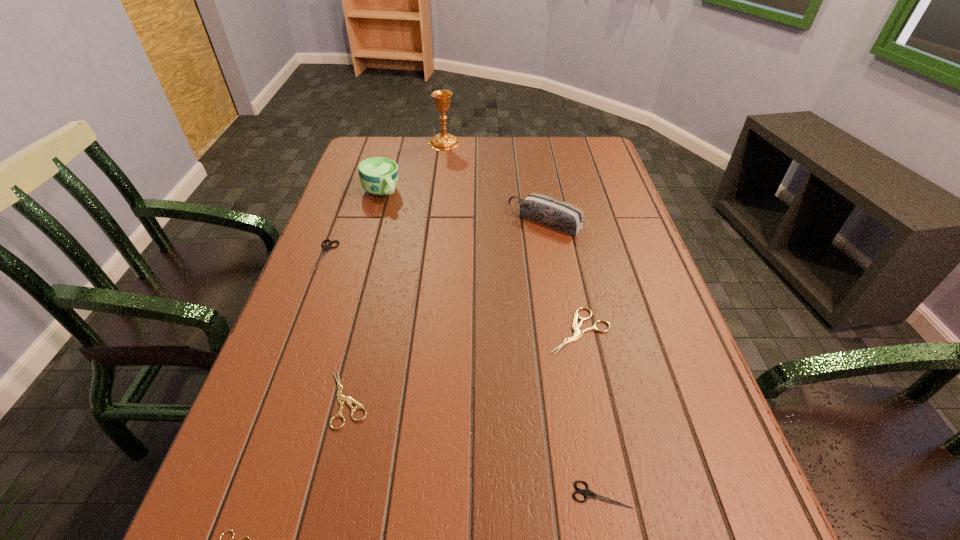
Where is `the second beige shears from right to left`? the second beige shears from right to left is located at coordinates (342, 399).

Where is `the third shears from left to right`? Image resolution: width=960 pixels, height=540 pixels. the third shears from left to right is located at coordinates (342, 399).

Find the location of a particular element. the smaller black shears is located at coordinates (587, 493).

Locate an element on the screen. Image resolution: width=960 pixels, height=540 pixels. the second nearest shears is located at coordinates (587, 493).

Locate an element on the screen. The width and height of the screenshot is (960, 540). blank area located on the right of the chalice is located at coordinates (510, 143).

You are a GUI agent. You are given a task and a screenshot of the screen. Output one action in this format:
    pyautogui.click(x=<x>, y=<y>)
    Task: Click on the vacant space located 0.190m on the right of the blue cup
    
    Given the screenshot: What is the action you would take?
    pyautogui.click(x=465, y=193)

In order to click on vacant space located on the back of the third tallest object in this screenshot , I will do `click(540, 193)`.

I want to click on free spot located on the right of the farthest shears, so click(x=420, y=256).

Identify the location of free space located 0.120m on the front of the rightmost beige shears. (595, 411).

Where is `vacant space positioned on the back of the third shears from left to right`? This screenshot has width=960, height=540. vacant space positioned on the back of the third shears from left to right is located at coordinates (362, 343).